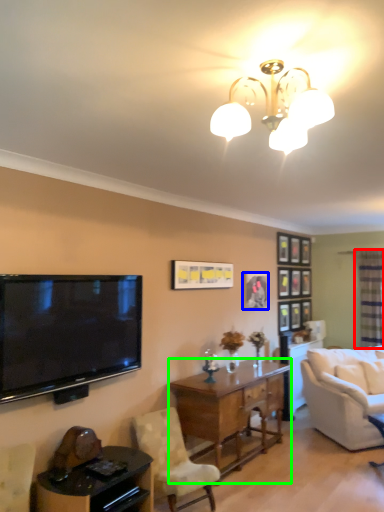
Question: Which object is the farthest from glass door (highlighted by a red box)? Choose among these: picture frame (highlighted by a blue box) or desk (highlighted by a green box).

Choices:
 (A) picture frame
 (B) desk

Answer: (B)